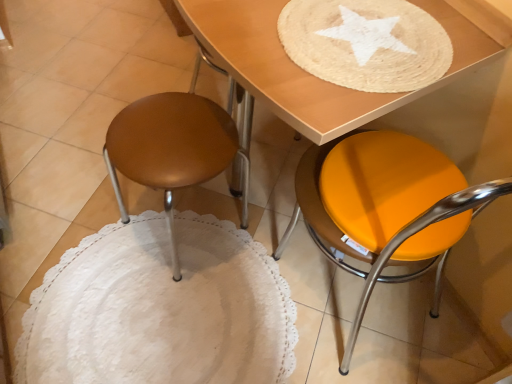
Question: Is orange matte stool at lower right to the left of matte brown stool at left from the viewer's perspective?

Choices:
 (A) yes
 (B) no

Answer: (B)

Question: Is matte brown stool at left at the back of orange matte stool at lower right?

Choices:
 (A) yes
 (B) no

Answer: (B)

Question: Would you say orange matte stool at lower right is outside matte brown stool at left?

Choices:
 (A) yes
 (B) no

Answer: (A)

Question: From the image's perspective, is orange matte stool at lower right on top of matte brown stool at left?

Choices:
 (A) no
 (B) yes

Answer: (A)

Question: Could you tell me if orange matte stool at lower right is turned towards matte brown stool at left?

Choices:
 (A) no
 (B) yes

Answer: (A)

Question: Does orange matte stool at lower right have a smaller size compared to matte brown stool at left?

Choices:
 (A) yes
 (B) no

Answer: (B)

Question: Is matte brown stool at left positioned far away from orange matte stool at lower right?

Choices:
 (A) yes
 (B) no

Answer: (B)

Question: Does matte brown stool at left lie in front of orange matte stool at lower right?

Choices:
 (A) no
 (B) yes

Answer: (A)

Question: Is matte brown stool at left not inside orange matte stool at lower right?

Choices:
 (A) no
 (B) yes

Answer: (B)

Question: From the image's perspective, is matte brown stool at left above orange matte stool at lower right?

Choices:
 (A) yes
 (B) no

Answer: (A)

Question: Is matte brown stool at left looking in the opposite direction of orange matte stool at lower right?

Choices:
 (A) no
 (B) yes

Answer: (A)

Question: Can you confirm if matte brown stool at left is bigger than orange matte stool at lower right?

Choices:
 (A) yes
 (B) no

Answer: (B)

Question: Is orange matte stool at lower right outside of wooden table at upper center?

Choices:
 (A) no
 (B) yes

Answer: (B)